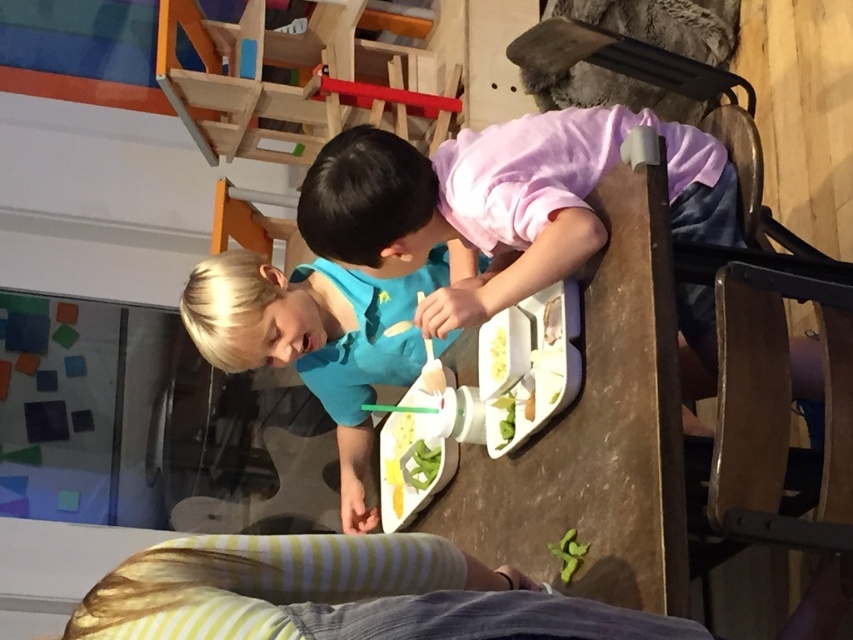
Based on the photo, you are a parent observing your children at the dining table. You notice the blue matte shirt at center and the green matte vegetable at center. Which object is positioned higher up in the scene?

The blue matte shirt at center is much taller as green matte vegetable at center, so the blue matte shirt at center is positioned higher up in the scene.

You are a photographer standing in the dining area. You want to take a closeup photo of the green matte vegetable at center. The camera you are using has a minimum focusing distance of 2 meters. Can you take the photo without moving closer?

The distance between the green matte vegetable at center and the camera is 2.59 meters, which is greater than the camera minimum focusing distance of 2 meters. Therefore, you can take the closeup photo without moving closer.